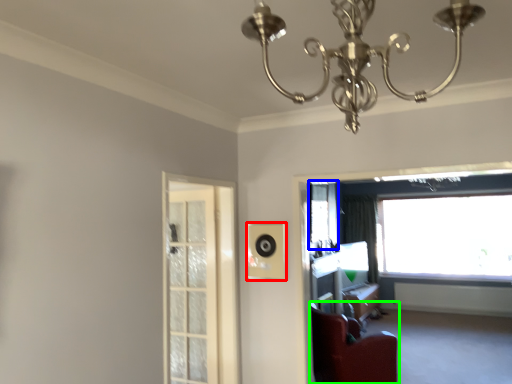
Question: Estimate the real-world distances between objects in this image. Which object is farther from speaker (highlighted by a red box), window screen (highlighted by a blue box) or furniture (highlighted by a green box)?

Choices:
 (A) window screen
 (B) furniture

Answer: (A)